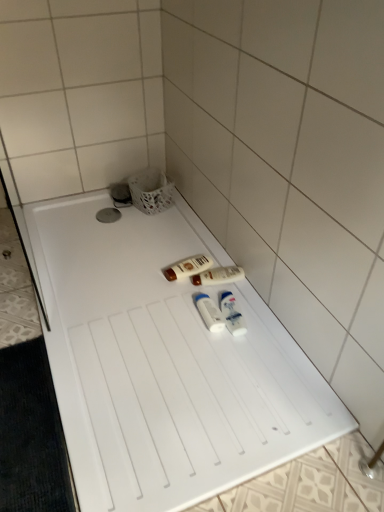
I want to click on free spot to the left of matte brown lotion at center, which is counted as the 4th toiletry, starting from the front, so click(143, 272).